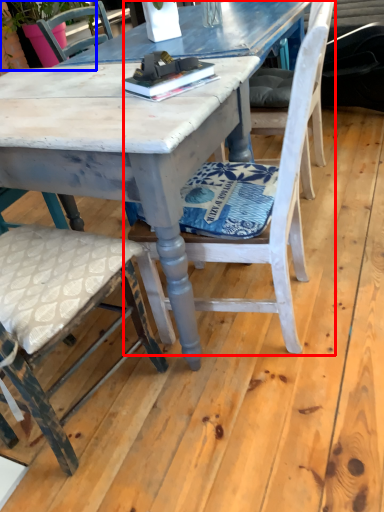
Question: Which object is further to the camera taking this photo, chair (highlighted by a red box) or plant (highlighted by a blue box)?

Choices:
 (A) chair
 (B) plant

Answer: (B)